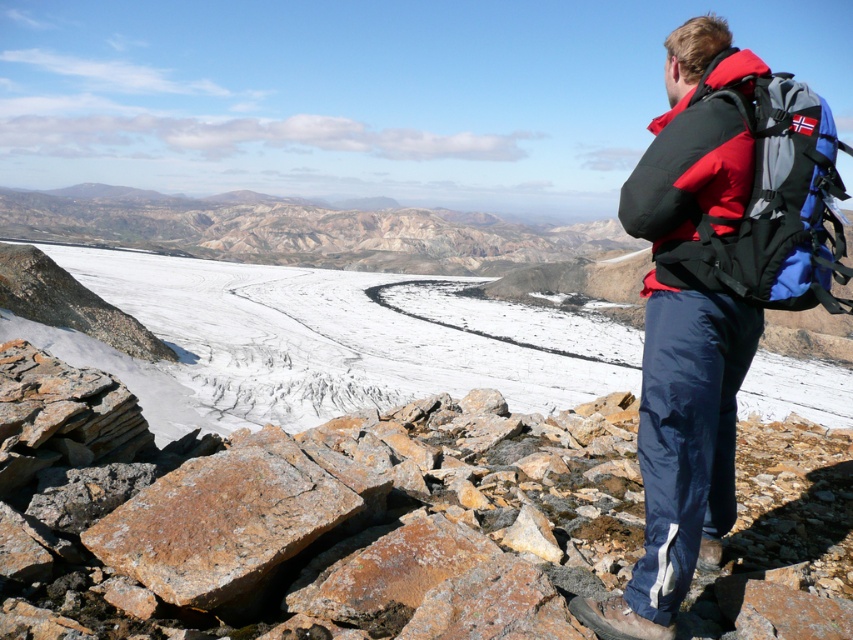
You are a photographer planning to take a picture of the matte black jacket at center and the blue fabric backpack at right. Based on their sizes in the image, which object should you focus on first if you want to ensure both are in sharp focus?

The matte black jacket at center is much taller than the blue fabric backpack at right, so focusing on the jacket first will help ensure both are in sharp focus since it is larger and closer to the camera.

You are a hiker trying to reach the base of the icy glacier. You have a 2.5 meter long rope. You see the rusty rock at lower left and the matte black jacket at center. Can you use the rope to safely cross the gap between them?

The distance between the rusty rock at lower left and the matte black jacket at center is 2.40 meters. Since the rope is 2.5 meters long, it is long enough to safely span the gap between them.

You are the hiker in the image and want to place your blue fabric backpack at right on top of the rusty rock at lower left. Can you do this without the backpack falling off?

The rusty rock at lower left has a lesser height compared to blue fabric backpack at right, so placing the backpack on top of the rock may cause it to tip over or fall off due to the backpack being taller than the rock.